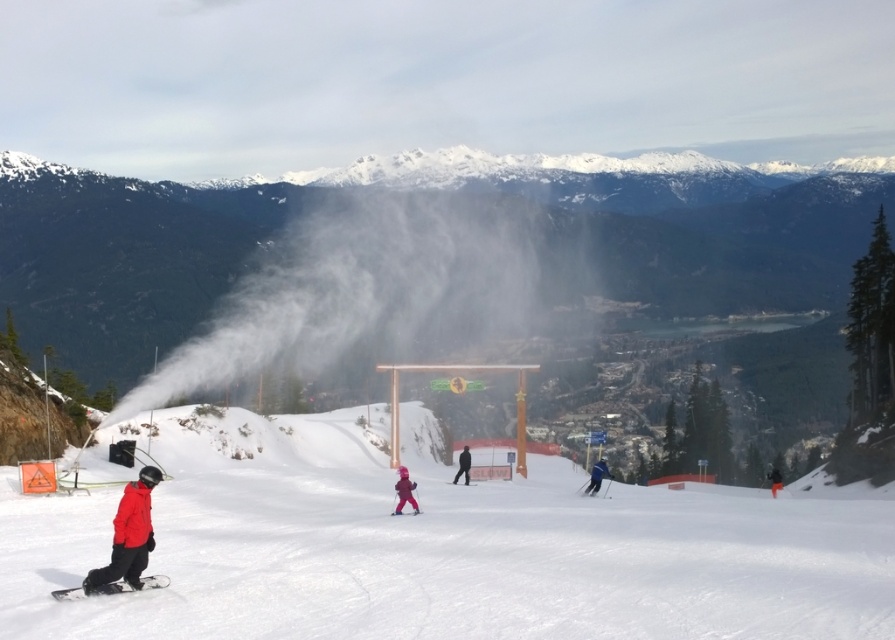
Question: Does blue matte jacket at center appear under pink fabric ski at center?

Choices:
 (A) no
 (B) yes

Answer: (B)

Question: Which of the following is the farthest from the observer?

Choices:
 (A) (465, 468)
 (B) (132, 580)

Answer: (A)

Question: Which point is farther from the camera taking this photo?

Choices:
 (A) (416, 512)
 (B) (591, 492)

Answer: (B)

Question: Does white powdery snow at lower left have a greater width compared to pink fabric snowsuit at center?

Choices:
 (A) no
 (B) yes

Answer: (B)

Question: Does orange snowsuit at lower right have a lesser width compared to matte blue ski at center?

Choices:
 (A) yes
 (B) no

Answer: (B)

Question: Estimate the real-world distances between objects in this image. Which object is closer to the blue matte jacket at center?

Choices:
 (A) white powder at center
 (B) black matte snowboard at lower left

Answer: (B)